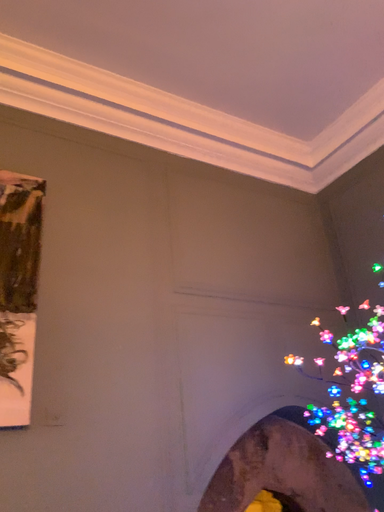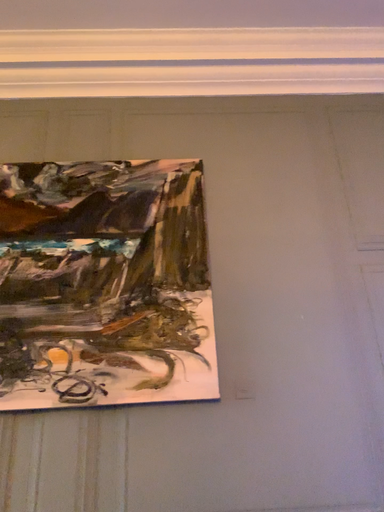
Question: Which way did the camera rotate in the video?

Choices:
 (A) rotated right
 (B) rotated left

Answer: (B)